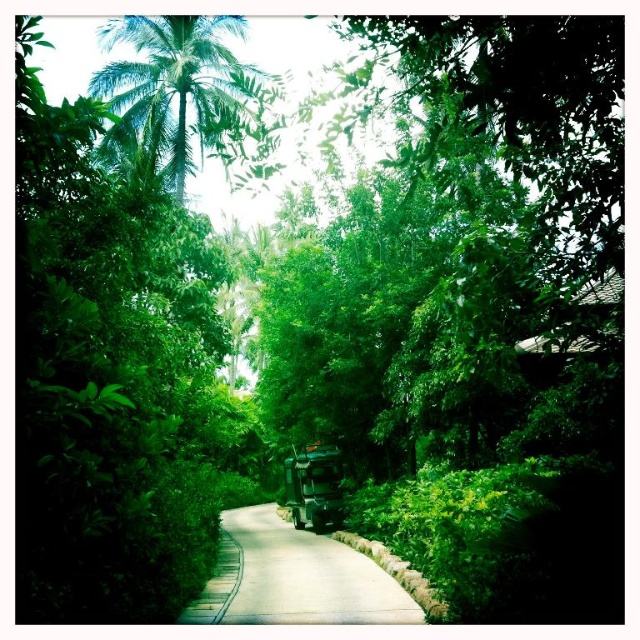
In the scene shown: Can you confirm if green leafy palm tree at upper left is wider than metallic green truck at center?

Yes.

You are a GUI agent. You are given a task and a screenshot of the screen. Output one action in this format:
    pyautogui.click(x=<x>, y=<y>)
    Task: Click on the green leafy palm tree at upper left
    
    Given the screenshot: What is the action you would take?
    pyautogui.click(x=177, y=83)

This screenshot has width=640, height=640. I want to click on green leafy palm tree at upper left, so click(177, 83).

From the picture: Does smooth asphalt path at center appear under metallic green truck at center?

Indeed, smooth asphalt path at center is positioned under metallic green truck at center.

What are the coordinates of `smooth asphalt path at center` in the screenshot? It's located at (294, 579).

Is point (273, 529) positioned behind point (316, 468)?

Yes, it is behind point (316, 468).

Find the location of a particular element. This screenshot has height=640, width=640. smooth asphalt path at center is located at coordinates (294, 579).

Measure the distance from green leafy palm tree at upper left to smooth asphalt path at center.

They are 7.89 meters apart.

Is green leafy palm tree at upper left wider than smooth asphalt path at center?

Yes, green leafy palm tree at upper left is wider than smooth asphalt path at center.

The width and height of the screenshot is (640, 640). What do you see at coordinates (177, 83) in the screenshot?
I see `green leafy palm tree at upper left` at bounding box center [177, 83].

At what (x,y) coordinates should I click in order to perform the action: click on green leafy palm tree at upper left. Please return your answer as a coordinate pair (x, y). The width and height of the screenshot is (640, 640). Looking at the image, I should click on (177, 83).